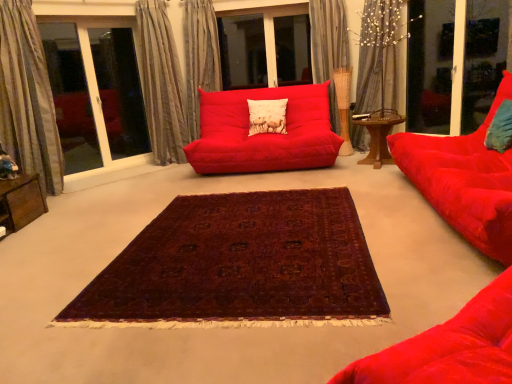
Locate an element on the screen. This screenshot has width=512, height=384. wooden at left, which ranks as the second table in back-to-front order is located at coordinates (21, 202).

Image resolution: width=512 pixels, height=384 pixels. What do you see at coordinates (378, 140) in the screenshot?
I see `wooden table at center, positioned as the 2th table in front-to-back order` at bounding box center [378, 140].

The width and height of the screenshot is (512, 384). Describe the element at coordinates (95, 94) in the screenshot. I see `transparent glass bay window at upper left` at that location.

At what (x,y) coordinates should I click in order to perform the action: click on silky gray curtain at upper center, which appears as the second curtain when viewed from the right. Please return your answer as a coordinate pair (x, y). Looking at the image, I should click on (332, 62).

Considering the relative sizes of silky gray curtain at upper center, which is the 1th curtain from right to left, and silky gray curtain at upper center, the fourth curtain positioned from the left, in the image provided, is silky gray curtain at upper center, which is the 1th curtain from right to left, taller than silky gray curtain at upper center, the fourth curtain positioned from the left,?

Yes, silky gray curtain at upper center, which is the 1th curtain from right to left, is taller than silky gray curtain at upper center, the fourth curtain positioned from the left.

Relative to silky gray curtain at upper center, the fourth curtain positioned from the left, is silky gray curtain at upper center, which appears as the fifth curtain when viewed from the left, in front or behind?

silky gray curtain at upper center, which appears as the fifth curtain when viewed from the left, is positioned closer to the viewer than silky gray curtain at upper center, the fourth curtain positioned from the left.

Would you say silky gray curtain at upper center, which is the 1th curtain from right to left, is to the left or to the right of silky gray curtain at upper center, which appears as the second curtain when viewed from the right, in the picture?

In the image, silky gray curtain at upper center, which is the 1th curtain from right to left, appears on the right side of silky gray curtain at upper center, which appears as the second curtain when viewed from the right.

Is silky gray curtain at upper center, which appears as the fifth curtain when viewed from the left, situated inside silky gray curtain at upper center, which appears as the second curtain when viewed from the right, or outside?

silky gray curtain at upper center, which appears as the fifth curtain when viewed from the left, exists outside the volume of silky gray curtain at upper center, which appears as the second curtain when viewed from the right.

Looking at this image, from a real-world perspective, between silky gray curtain at upper left, placed as the fourth curtain when sorted from right to left, and deep burgundy woven rug at center, who is vertically lower?

deep burgundy woven rug at center, from a real-world perspective.

Can you confirm if silky gray curtain at upper left, placed as the fourth curtain when sorted from right to left, is shorter than deep burgundy woven rug at center?

No.

Is silky gray curtain at upper left, which appears as the second curtain when viewed from the left, positioned with its back to deep burgundy woven rug at center?

That's not correct — silky gray curtain at upper left, which appears as the second curtain when viewed from the left, is not looking away from deep burgundy woven rug at center.

Which object is positioned more to the right, silky gray curtain at upper left, which appears as the second curtain when viewed from the left, or deep burgundy woven rug at center?

Positioned to the right is deep burgundy woven rug at center.

Consider the image. Can you confirm if silky gray curtain at upper center, which appears as the fifth curtain when viewed from the left, is wider than matte red studio couch at center, which is counted as the first studio couch, starting from the back?

No.

Is silky gray curtain at upper center, which is the 1th curtain from right to left, with matte red studio couch at center, which is counted as the first studio couch, starting from the back?

No, silky gray curtain at upper center, which is the 1th curtain from right to left, is not next to matte red studio couch at center, which is counted as the first studio couch, starting from the back.

In terms of size, does silky gray curtain at upper center, which appears as the fifth curtain when viewed from the left, appear bigger or smaller than matte red studio couch at center, which is counted as the 1th studio couch, starting from the left?

Clearly, silky gray curtain at upper center, which appears as the fifth curtain when viewed from the left, is smaller in size than matte red studio couch at center, which is counted as the 1th studio couch, starting from the left.

In the image, is silky gray curtain at upper center, which appears as the fifth curtain when viewed from the left, positioned in front of or behind matte red studio couch at center, which is counted as the first studio couch, starting from the back?

Clearly, silky gray curtain at upper center, which appears as the fifth curtain when viewed from the left, is behind matte red studio couch at center, which is counted as the first studio couch, starting from the back.

Would you say matte red studio couch at center, the 2th studio couch viewed from the front, is outside wooden table at center, which is counted as the first table, starting from the back?

Indeed, matte red studio couch at center, the 2th studio couch viewed from the front, is completely outside wooden table at center, which is counted as the first table, starting from the back.

I want to click on studio couch above the wooden table at center, placed as the 2th table when sorted from left to right (from the image's perspective), so point(264,133).

Is matte red studio couch at center, which is counted as the 1th studio couch, starting from the left, directly adjacent to wooden table at center, which is counted as the first table, starting from the back?

No, matte red studio couch at center, which is counted as the 1th studio couch, starting from the left, is not with wooden table at center, which is counted as the first table, starting from the back.

Who is taller, matte red studio couch at center, which is counted as the first studio couch, starting from the back, or wooden table at center, which is the 1th table from top to bottom?

matte red studio couch at center, which is counted as the first studio couch, starting from the back, is taller.

From a real-world perspective, who is located lower, silky beige curtain at left, which is counted as the 5th curtain, starting from the right, or silky beige curtain at upper center, the 3th curtain in the left-to-right sequence?

silky beige curtain at left, which is counted as the 5th curtain, starting from the right.

From the image's perspective, does silky beige curtain at left, which is counted as the 5th curtain, starting from the right, appear lower than silky beige curtain at upper center, the 3th curtain in the left-to-right sequence?

Correct, silky beige curtain at left, which is counted as the 5th curtain, starting from the right, appears lower than silky beige curtain at upper center, the 3th curtain in the left-to-right sequence, in the image.

Between silky beige curtain at left, which is counted as the 5th curtain, starting from the right, and silky beige curtain at upper center, which ranks as the 3th curtain in right-to-left order, which one has smaller width?

Thinner between the two is silky beige curtain at left, which is counted as the 5th curtain, starting from the right.

Which is in front, silky beige curtain at left, which is counted as the 5th curtain, starting from the right, or silky beige curtain at upper center, which ranks as the 3th curtain in right-to-left order?

silky beige curtain at left, which is counted as the 5th curtain, starting from the right, is in front.

Does point (321, 120) appear closer or farther from the camera than point (358, 146)?

Point (321, 120) appears to be closer to the viewer than point (358, 146).

From a real-world perspective, is matte red studio couch at center, the 2th studio couch viewed from the front, positioned above or below silky gray curtain at upper center, which appears as the fifth curtain when viewed from the left?

From a real-world perspective, matte red studio couch at center, the 2th studio couch viewed from the front, is physically below silky gray curtain at upper center, which appears as the fifth curtain when viewed from the left.

Is transparent glass bay window at upper left placed right next to silky beige curtain at upper center, the 3th curtain in the left-to-right sequence?

Answer: transparent glass bay window at upper left is not next to silky beige curtain at upper center, the 3th curtain in the left-to-right sequence, and they're not touching.

Visually, is transparent glass bay window at upper left positioned to the left or to the right of silky beige curtain at upper center, which ranks as the 3th curtain in right-to-left order?

Based on their positions, transparent glass bay window at upper left is located to the left of silky beige curtain at upper center, which ranks as the 3th curtain in right-to-left order.

Is transparent glass bay window at upper left taller or shorter than silky beige curtain at upper center, the 3th curtain in the left-to-right sequence?

In the image, transparent glass bay window at upper left appears to be taller than silky beige curtain at upper center, the 3th curtain in the left-to-right sequence.

Is transparent glass bay window at upper left positioned with its back to silky beige curtain at upper center, which ranks as the 3th curtain in right-to-left order?

That's not correct — transparent glass bay window at upper left is not looking away from silky beige curtain at upper center, which ranks as the 3th curtain in right-to-left order.

At what (x,y) coordinates should I click in order to perform the action: click on curtain that is the 2nd object located behind the silky gray curtain at upper center, which appears as the fifth curtain when viewed from the left. Please return your answer as a coordinate pair (x, y). Image resolution: width=512 pixels, height=384 pixels. Looking at the image, I should click on (332, 62).

This screenshot has width=512, height=384. What are the coordinates of `mat on the right of silky gray curtain at upper left, placed as the fourth curtain when sorted from right to left` in the screenshot? It's located at (240, 265).

Based on their spatial positions, is wooden table at center, placed as the 2th table when sorted from left to right, or transparent glass screen door at upper right closer to silky gray curtain at upper left, placed as the fourth curtain when sorted from right to left?

Among the two, wooden table at center, placed as the 2th table when sorted from left to right, is located nearer to silky gray curtain at upper left, placed as the fourth curtain when sorted from right to left.

Estimate the real-world distances between objects in this image. Which object is further from matte white cushion at center, acting as the second pillow starting from the front, transparent glass bay window at upper left or matte red studio couch at center, the 2th studio couch positioned from the right?

Based on the image, transparent glass bay window at upper left appears to be further to matte white cushion at center, acting as the second pillow starting from the front.

When comparing their distances from transparent glass bay window at upper left, does silky gray curtain at upper center, which appears as the fifth curtain when viewed from the left, or deep burgundy woven rug at center seem closer?

Based on the image, silky gray curtain at upper center, which appears as the fifth curtain when viewed from the left, appears to be nearer to transparent glass bay window at upper left.

In the scene shown: Which object lies nearer to the anchor point silky gray curtain at upper center, which is the 1th curtain from right to left, silky beige curtain at upper center, which ranks as the 3th curtain in right-to-left order, or wooden table at center, positioned as the 2th table in front-to-back order?

Among the two, wooden table at center, positioned as the 2th table in front-to-back order, is located nearer to silky gray curtain at upper center, which is the 1th curtain from right to left.

From the image, which object appears to be nearer to wooden at left, the second table from the right, silky beige curtain at left, which is counted as the 5th curtain, starting from the right, or silky gray curtain at upper center, which is the 1th curtain from right to left?

silky beige curtain at left, which is counted as the 5th curtain, starting from the right, lies closer to wooden at left, the second table from the right, than the other object.

Looking at the image, which one is located further to silky gray curtain at upper center, which is the 1th curtain from right to left, transparent glass bay window at upper left or silky beige curtain at left, acting as the first curtain starting from the left?

silky beige curtain at left, acting as the first curtain starting from the left, lies further to silky gray curtain at upper center, which is the 1th curtain from right to left, than the other object.

Based on their spatial positions, is silky beige curtain at left, which is counted as the 5th curtain, starting from the right, or deep burgundy woven rug at center closer to silky gray curtain at upper center, which appears as the second curtain when viewed from the right?

Based on the image, silky beige curtain at left, which is counted as the 5th curtain, starting from the right, appears to be nearer to silky gray curtain at upper center, which appears as the second curtain when viewed from the right.

Based on their spatial positions, is wooden table at center, the 2th table when ordered from bottom to top, or silky gray curtain at upper center, which is the 1th curtain from right to left, closer to transparent glass screen door at upper right?

The object closer to transparent glass screen door at upper right is silky gray curtain at upper center, which is the 1th curtain from right to left.

The height and width of the screenshot is (384, 512). What are the coordinates of `studio couch situated between wooden at left, the 2th table viewed from the top, and matte white cushion at center, which is the first pillow in back-to-front order, from left to right` in the screenshot? It's located at (264, 133).

Where is `pillow between wooden at left, the 1th table when ordered from left to right, and wooden table at center, which is the 1th table from top to bottom`? pillow between wooden at left, the 1th table when ordered from left to right, and wooden table at center, which is the 1th table from top to bottom is located at coordinates (267, 116).

You are a GUI agent. You are given a task and a screenshot of the screen. Output one action in this format:
    pyautogui.click(x=<x>, y=<y>)
    Task: Click on the pillow situated between transparent glass bay window at upper left and wooden table at center, the first table when ordered from right to left, from left to right
    The image size is (512, 384).
    Given the screenshot: What is the action you would take?
    pyautogui.click(x=267, y=116)

This screenshot has width=512, height=384. What are the coordinates of `pillow situated between matte red studio couch at center, the 2th studio couch viewed from the front, and wooden table at center, which is the 1th table from top to bottom, from left to right` in the screenshot? It's located at (267, 116).